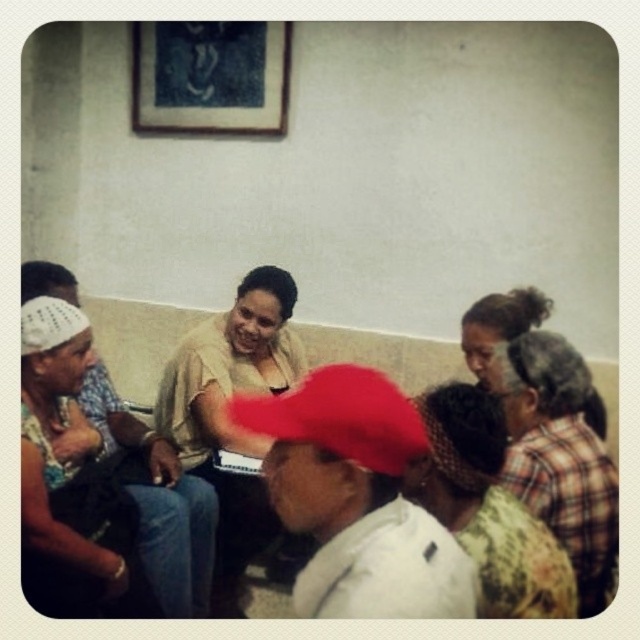
Question: Is floral fabric dress at right smaller than blue fabric picture frame at upper center?

Choices:
 (A) yes
 (B) no

Answer: (A)

Question: Which point is farther to the camera?

Choices:
 (A) white woven hat at left
 (B) floral fabric dress at right

Answer: (A)

Question: Which point is closer to the camera?

Choices:
 (A) red fabric cap at center
 (B) blue fabric picture frame at upper center
 (C) white woven hat at left

Answer: (A)

Question: Does red fabric cap at center appear over matte beige sweater at center?

Choices:
 (A) no
 (B) yes

Answer: (B)

Question: Among these points, which one is nearest to the camera?

Choices:
 (A) (209, 49)
 (B) (115, 442)
 (C) (364, 488)

Answer: (C)

Question: Can you confirm if red fabric cap at center is wider than white woven hat at left?

Choices:
 (A) yes
 (B) no

Answer: (B)